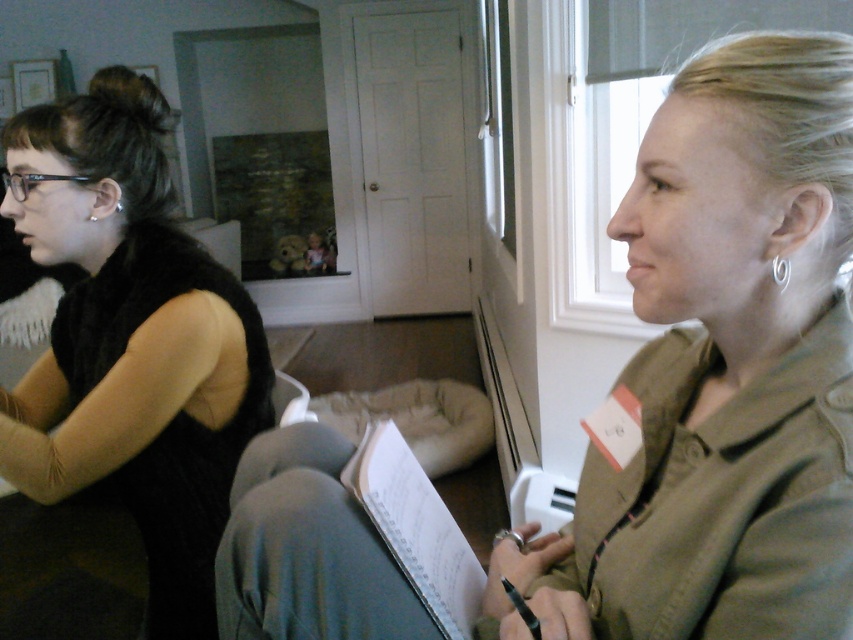
You are a photographer trying to capture a clear photo of the white paper at center. However, the matte olive green jacket at right is blocking your view. Can you move the jacket to get a clear shot of the paper?

The matte olive green jacket at right is in front of the white paper at center, so moving it would allow you to capture the white paper at center without obstruction.

You are organizing a meeting and need to place a 30 cm wide folder between the matte olive green jacket at right and the white paper at center. Based on their widths, will the folder fit between them without overlapping?

The matte olive green jacket at right is wider than the white paper at center. Since the folder is 30 cm wide, it depends on the exact space between them. However, the description only states the jacket is wider, not the total distance. Without knowing the distance between the two objects, we cannot confirm if the folder will fit.

You are standing in the room where the two people are sitting. You need to walk from point A at coordinates point (648,401) to point B at coordinates point (100,163). Which direction should you face to walk straight towards point B?

You should face towards the lower left direction to walk straight from point A at coordinates point (648,401) to point B at coordinates point (100,163), since point B is located to the lower left of point A.